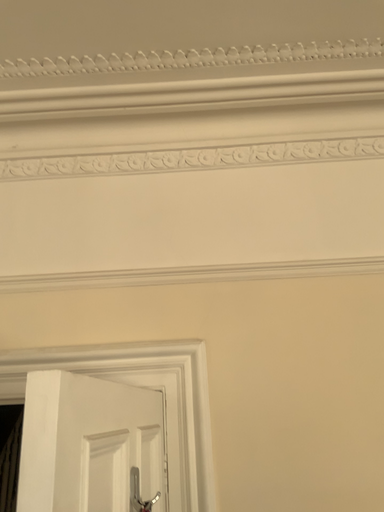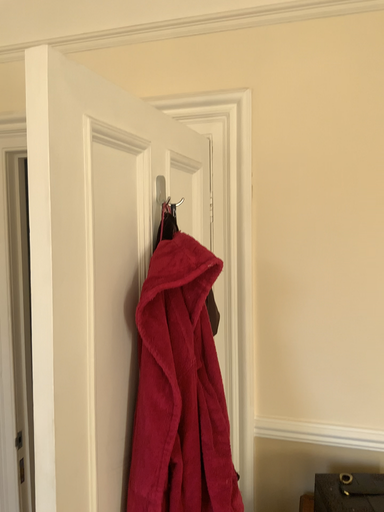
Question: Which way did the camera rotate in the video?

Choices:
 (A) rotated downward
 (B) rotated upward

Answer: (A)